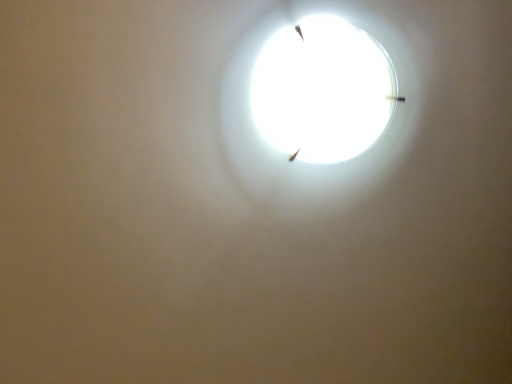
Question: Should I look upward or downward to see white glossy lampshade at upper center?

Choices:
 (A) up
 (B) down

Answer: (A)